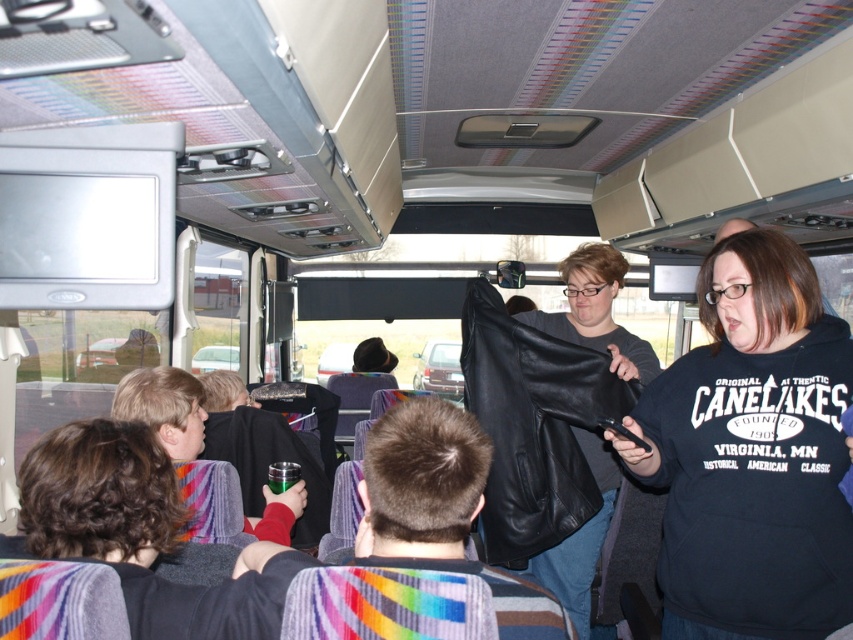
Can you confirm if black matte sweatshirt at center is thinner than black leather jacket at center?

In fact, black matte sweatshirt at center might be wider than black leather jacket at center.

Is black matte sweatshirt at center wider than black leather jacket at center?

Yes.

Which is behind, point (640, 397) or point (550, 580)?

Positioned behind is point (550, 580).

Find the location of a particular element. black matte sweatshirt at center is located at coordinates (752, 452).